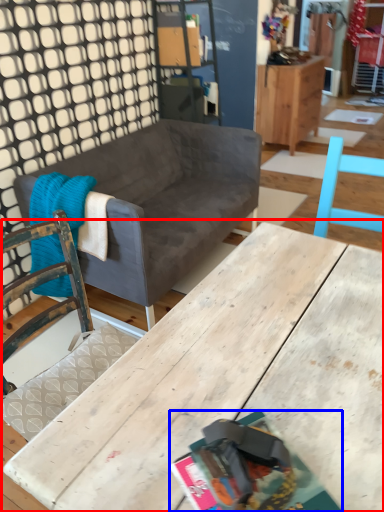
Question: Which of the following is the farthest to the observer, table (highlighted by a red box) or magazine (highlighted by a blue box)?

Choices:
 (A) table
 (B) magazine

Answer: (B)